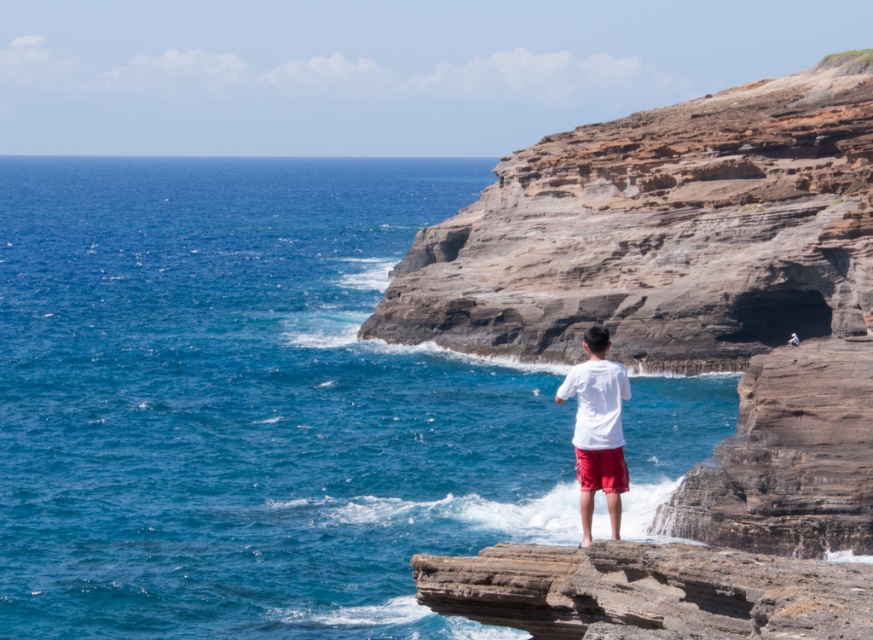
Question: Can you confirm if blue water at center is wider than red cotton shorts at center?

Choices:
 (A) yes
 (B) no

Answer: (A)

Question: Which point appears farthest from the camera in this image?

Choices:
 (A) (610, 492)
 (B) (145, 388)
 (C) (583, 397)
 (D) (746, 289)

Answer: (D)

Question: Is blue water at center in front of brown rocky cliff at center-right?

Choices:
 (A) no
 (B) yes

Answer: (B)

Question: Which point appears closest to the camera in this image?

Choices:
 (A) (593, 488)
 (B) (576, 464)
 (C) (9, 372)

Answer: (A)

Question: Can you confirm if blue water at center is positioned below white cotton shirt at center?

Choices:
 (A) yes
 (B) no

Answer: (B)

Question: Which of the following is the farthest from the observer?

Choices:
 (A) brown rocky cliff at center-right
 (B) blue water at center
 (C) red cotton shorts at center
 (D) white cotton shirt at center

Answer: (A)